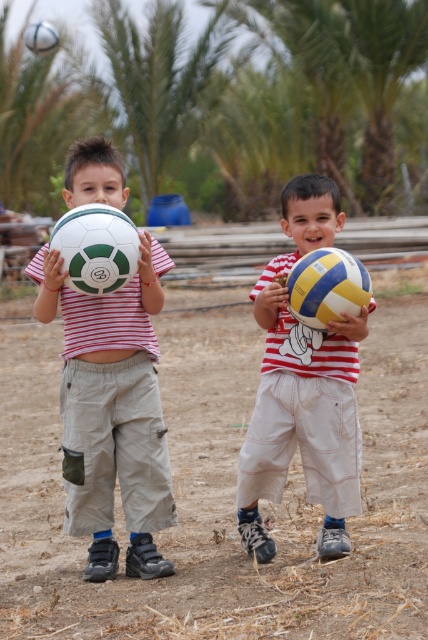
You are organizing a sports day and need to decide which ball to use for a game that requires a larger ball. Based on the image, which ball should you choose between the matte green and white soccer ball at left and the matte yellow and blue volleyball at center?

The matte green and white soccer ball at left is bigger than the matte yellow and blue volleyball at center, so you should choose the matte green and white soccer ball at left for the game that requires a larger ball.

You are a photographer trying to capture a photo of the brown dirt field at center and the white matte soccer ball at upper left. Based on their positions, can you tell which object is closer to the camera?

The brown dirt field at center is below the white matte soccer ball at upper left, so the dirt field is farther away from the camera compared to the soccer ball.

You are a soccer coach trying to set up a training exercise. You need to place two soccer balls exactly 60 centimeters apart. You have the matte green and white soccer ball at left and the white matte soccer ball at left. Can you use these two balls as they are positioned in the image?

The distance between the matte green and white soccer ball at left and the white matte soccer ball at left is 54.14 centimeters, which is less than the required 60 centimeters. Therefore, the balls are too close to meet the 60 cm requirement.